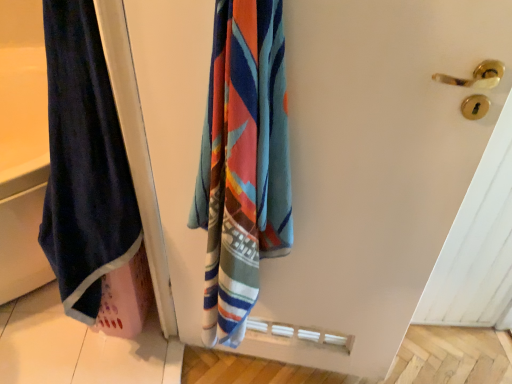
Question: Is velvet dark blue towel at left at the right side of velvet dark blue towel at left?

Choices:
 (A) no
 (B) yes

Answer: (B)

Question: Considering the relative sizes of velvet dark blue towel at left and velvet dark blue towel at left in the image provided, is velvet dark blue towel at left shorter than velvet dark blue towel at left?

Choices:
 (A) yes
 (B) no

Answer: (B)

Question: Considering the relative sizes of velvet dark blue towel at left and velvet dark blue towel at left in the image provided, is velvet dark blue towel at left bigger than velvet dark blue towel at left?

Choices:
 (A) no
 (B) yes

Answer: (A)

Question: Is velvet dark blue towel at left turned away from velvet dark blue towel at left?

Choices:
 (A) no
 (B) yes

Answer: (A)

Question: Would you say velvet dark blue towel at left is a long distance from velvet dark blue towel at left?

Choices:
 (A) no
 (B) yes

Answer: (A)

Question: From a real-world perspective, is velvet dark blue towel at left physically above velvet dark blue towel at left?

Choices:
 (A) no
 (B) yes

Answer: (A)

Question: Is velvet dark blue towel at left thinner than velvet dark blue towel at left?

Choices:
 (A) no
 (B) yes

Answer: (A)

Question: Is the depth of velvet dark blue towel at left less than that of velvet dark blue towel at left?

Choices:
 (A) no
 (B) yes

Answer: (A)

Question: From the image's perspective, is velvet dark blue towel at left above velvet dark blue towel at left?

Choices:
 (A) no
 (B) yes

Answer: (B)

Question: Considering the relative sizes of velvet dark blue towel at left and velvet dark blue towel at left in the image provided, is velvet dark blue towel at left wider than velvet dark blue towel at left?

Choices:
 (A) yes
 (B) no

Answer: (A)

Question: Considering the relative sizes of velvet dark blue towel at left and velvet dark blue towel at left in the image provided, is velvet dark blue towel at left taller than velvet dark blue towel at left?

Choices:
 (A) no
 (B) yes

Answer: (A)

Question: From the image's perspective, does velvet dark blue towel at left appear lower than velvet dark blue towel at left?

Choices:
 (A) yes
 (B) no

Answer: (B)

Question: Is velvet dark blue towel at left in front of or behind velvet dark blue towel at left in the image?

Choices:
 (A) behind
 (B) front

Answer: (A)